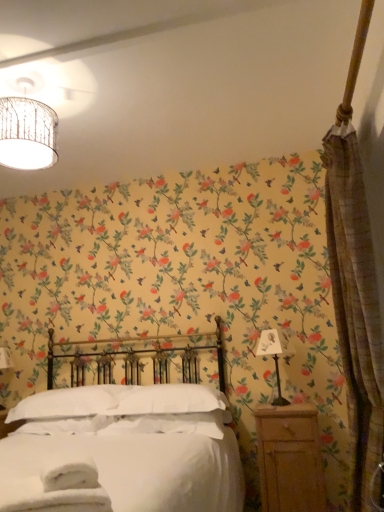
Describe the element at coordinates (290, 459) in the screenshot. The image size is (384, 512). I see `wooden nightstand at lower right` at that location.

Identify the location of metallic silver lamp at right. (274, 356).

What do you see at coordinates (67, 403) in the screenshot? I see `white soft pillow at center, the second pillow from the right` at bounding box center [67, 403].

I want to click on white matte bed at center, so click(123, 448).

Looking at this image, from the image's perspective, is white matte bed at center positioned above or below wooden nightstand at lower right?

From the image's perspective, white matte bed at center appears above wooden nightstand at lower right.

Which of these two, white matte bed at center or wooden nightstand at lower right, stands taller?

white matte bed at center is taller.

Which point is more forward, [215,432] or [272,479]?

The point [272,479] is in front.

Can you confirm if white matte bed at center is thinner than wooden nightstand at lower right?

No.

Could you measure the distance between wooden nightstand at lower right and white soft pillow at center, positioned as the 1th pillow in left-to-right order?

wooden nightstand at lower right and white soft pillow at center, positioned as the 1th pillow in left-to-right order, are 1.13 meters apart from each other.

Does wooden nightstand at lower right have a larger size compared to white soft pillow at center, the second pillow from the right?

No, wooden nightstand at lower right is not bigger than white soft pillow at center, the second pillow from the right.

Between wooden nightstand at lower right and white soft pillow at center, positioned as the 1th pillow in left-to-right order, which one has smaller width?

Thinner between the two is wooden nightstand at lower right.

From a real-world perspective, is white soft pillow at center, positioned as the 1th pillow in left-to-right order, on wooden nightstand at lower right?

Correct, in the physical world, white soft pillow at center, positioned as the 1th pillow in left-to-right order, is higher than wooden nightstand at lower right.

Which of these two, white soft pillow at center, positioned as the 1th pillow in left-to-right order, or wooden nightstand at lower right, stands taller?

Standing taller between the two is wooden nightstand at lower right.

Are white soft pillow at center, positioned as the 1th pillow in left-to-right order, and wooden nightstand at lower right beside each other?

white soft pillow at center, positioned as the 1th pillow in left-to-right order, and wooden nightstand at lower right are clearly separated.

Is wooden nightstand at lower right a part of white soft pillow at center, the second pillow from the right?

No, white soft pillow at center, the second pillow from the right, does not contain wooden nightstand at lower right.

Which is behind, white matte bed at center or white soft pillow at center, positioned as the 1th pillow in left-to-right order?

white soft pillow at center, positioned as the 1th pillow in left-to-right order, is further from the camera.

From a real-world perspective, is white matte bed at center below white soft pillow at center, positioned as the 1th pillow in left-to-right order?

Yes, from a real-world perspective, white matte bed at center is below white soft pillow at center, positioned as the 1th pillow in left-to-right order.

Considering the positions of point (163, 492) and point (18, 418), is point (163, 492) closer or farther from the camera than point (18, 418)?

Point (163, 492).

Considering the sizes of objects white matte bed at center and white soft pillow at center, the second pillow from the right, in the image provided, who is smaller, white matte bed at center or white soft pillow at center, the second pillow from the right,?

With smaller size is white soft pillow at center, the second pillow from the right.

Are white matte bed at center and metallic silver lamp at right making contact?

They are not placed beside each other.

What are the coordinates of `bedside lamp located behind the white matte bed at center` in the screenshot? It's located at click(x=274, y=356).

Considering the relative sizes of white matte bed at center and metallic silver lamp at right in the image provided, is white matte bed at center wider than metallic silver lamp at right?

Correct, the width of white matte bed at center exceeds that of metallic silver lamp at right.

Is point (165, 496) closer to camera compared to point (277, 362)?

That is True.

Does point (361, 266) lie in front of point (129, 393)?

Yes, point (361, 266) is in front of point (129, 393).

From the picture: Considering the relative sizes of textured beige curtain at right and white soft pillow at center, which is counted as the 2th pillow, starting from the left, in the image provided, is textured beige curtain at right taller than white soft pillow at center, which is counted as the 2th pillow, starting from the left,?

Yes.

From a real-world perspective, between textured beige curtain at right and white soft pillow at center, which is counted as the 2th pillow, starting from the left, who is vertically lower?

In real-world perspective, white soft pillow at center, which is counted as the 2th pillow, starting from the left, is lower.

In the scene shown: Is textured beige curtain at right located outside white soft pillow at center, the first pillow when ordered from right to left?

Yes, textured beige curtain at right is not within white soft pillow at center, the first pillow when ordered from right to left.

From the image's perspective, is textured beige curtain at right on white matte bed at center?

Indeed, from the image's perspective, textured beige curtain at right is shown above white matte bed at center.

Could you tell me if textured beige curtain at right is facing white matte bed at center?

Yes, textured beige curtain at right is facing white matte bed at center.

From the picture: In the image, is textured beige curtain at right positioned in front of or behind white matte bed at center?

textured beige curtain at right is behind white matte bed at center.

Identify the location of bed below the textured beige curtain at right (from a real-world perspective). (123, 448).

Locate an element on the screen. nightstand below the white matte bed at center (from the image's perspective) is located at coordinates (290, 459).

The width and height of the screenshot is (384, 512). I want to click on pillow that is the 2nd object located behind the wooden nightstand at lower right, so click(67, 403).

Considering their positions, is wooden nightstand at lower right positioned further to white soft pillow at center, the first pillow when ordered from right to left, than white matte bed at center?

wooden nightstand at lower right is positioned further to the anchor white soft pillow at center, the first pillow when ordered from right to left.

Considering their positions, is wooden nightstand at lower right positioned closer to metallic silver lamp at right than white soft pillow at center, positioned as the 1th pillow in left-to-right order?

wooden nightstand at lower right is closer to metallic silver lamp at right.

Estimate the real-world distances between objects in this image. Which object is further from metallic silver lamp at right, white soft pillow at center, the second pillow from the right, or white matte bed at center?

white soft pillow at center, the second pillow from the right, is further to metallic silver lamp at right.

From the picture: Which object lies further to the anchor point white soft pillow at center, the first pillow when ordered from right to left, wooden nightstand at lower right or white soft pillow at center, the second pillow from the right?

wooden nightstand at lower right lies further to white soft pillow at center, the first pillow when ordered from right to left, than the other object.

Estimate the real-world distances between objects in this image. Which object is closer to wooden nightstand at lower right, white matte bed at center or white soft pillow at center, the first pillow when ordered from right to left?

white soft pillow at center, the first pillow when ordered from right to left, lies closer to wooden nightstand at lower right than the other object.

Looking at the image, which one is located further to white soft pillow at center, which is counted as the 2th pillow, starting from the left, textured beige curtain at right or metallic silver lamp at right?

textured beige curtain at right is further to white soft pillow at center, which is counted as the 2th pillow, starting from the left.

When comparing their distances from white matte bed at center, does matte woven lampshade at upper left or textured beige curtain at right seem further?

Based on the image, matte woven lampshade at upper left appears to be further to white matte bed at center.

Estimate the real-world distances between objects in this image. Which object is further from textured beige curtain at right, wooden nightstand at lower right or metallic silver lamp at right?

metallic silver lamp at right lies further to textured beige curtain at right than the other object.

Where is `pillow that lies between matte woven lampshade at upper left and white soft pillow at center, positioned as the 1th pillow in left-to-right order, from top to bottom`? This screenshot has height=512, width=384. pillow that lies between matte woven lampshade at upper left and white soft pillow at center, positioned as the 1th pillow in left-to-right order, from top to bottom is located at coordinates (170, 400).

At what (x,y) coordinates should I click in order to perform the action: click on curtain positioned between white matte bed at center and metallic silver lamp at right from near to far. Please return your answer as a coordinate pair (x, y). The image size is (384, 512). Looking at the image, I should click on (356, 289).

This screenshot has height=512, width=384. What are the coordinates of `nightstand between white matte bed at center and metallic silver lamp at right in the front-back direction` in the screenshot? It's located at (x=290, y=459).

Identify the location of nightstand between white soft pillow at center, the second pillow from the right, and textured beige curtain at right, in the horizontal direction. (290, 459).